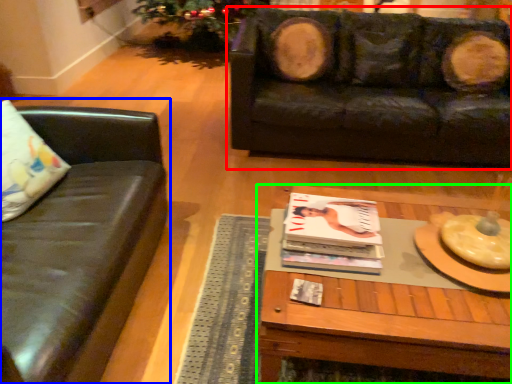
Question: Which object is positioned closest to studio couch (highlighted by a red box)? Select from studio couch (highlighted by a blue box) and coffee table (highlighted by a green box).

Choices:
 (A) studio couch
 (B) coffee table

Answer: (B)